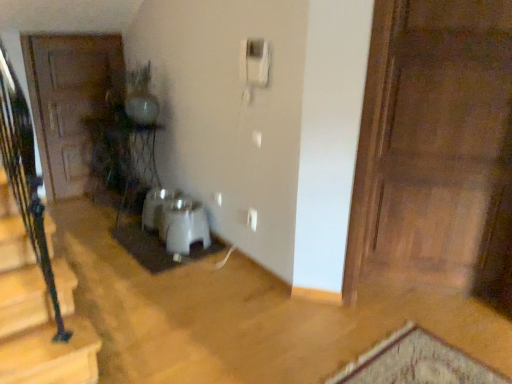
Question: Should I look upward or downward to see white matte doormat at center?

Choices:
 (A) down
 (B) up

Answer: (A)

Question: Is white plastic corded phone at upper center taller than wooden door at left, which ranks as the first door in left-to-right order?

Choices:
 (A) yes
 (B) no

Answer: (B)

Question: From the image's perspective, would you say white plastic corded phone at upper center is shown under wooden door at left, which is the 2th door from front to back?

Choices:
 (A) yes
 (B) no

Answer: (B)

Question: Is white plastic corded phone at upper center outside of wooden door at left, which is the 2th door from front to back?

Choices:
 (A) yes
 (B) no

Answer: (A)

Question: Is wooden door at left, which ranks as the first door in left-to-right order, at the back of white plastic corded phone at upper center?

Choices:
 (A) yes
 (B) no

Answer: (B)

Question: Does white plastic corded phone at upper center contain wooden door at left, which ranks as the first door in left-to-right order?

Choices:
 (A) no
 (B) yes

Answer: (A)

Question: Is white plastic corded phone at upper center bigger than wooden door at left, arranged as the second door when viewed from the right?

Choices:
 (A) no
 (B) yes

Answer: (A)

Question: Can you confirm if white plastic water heater at center is bigger than white matte doormat at center?

Choices:
 (A) yes
 (B) no

Answer: (A)

Question: From a real-world perspective, is white plastic water heater at center physically above white matte doormat at center?

Choices:
 (A) no
 (B) yes

Answer: (B)

Question: Is white plastic water heater at center oriented towards white matte doormat at center?

Choices:
 (A) yes
 (B) no

Answer: (B)

Question: From the image's perspective, does white plastic water heater at center appear higher than white matte doormat at center?

Choices:
 (A) yes
 (B) no

Answer: (A)

Question: Can you confirm if white plastic water heater at center is wider than white matte doormat at center?

Choices:
 (A) yes
 (B) no

Answer: (B)

Question: From a real-world perspective, is white plastic water heater at center beneath white matte doormat at center?

Choices:
 (A) no
 (B) yes

Answer: (A)

Question: Can you confirm if white matte doormat at center is positioned to the right of wooden door at right, which ranks as the 1th door in front-to-back order?

Choices:
 (A) no
 (B) yes

Answer: (A)